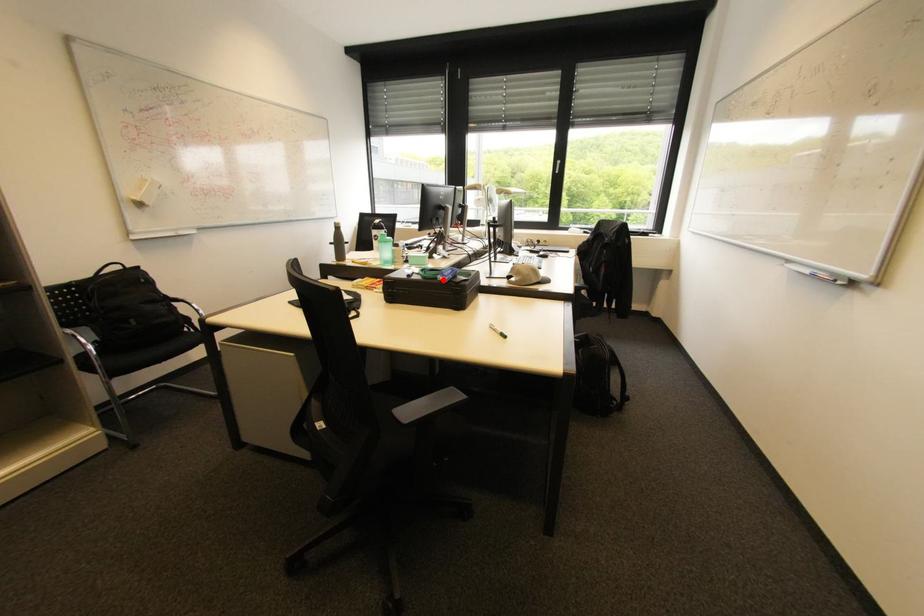
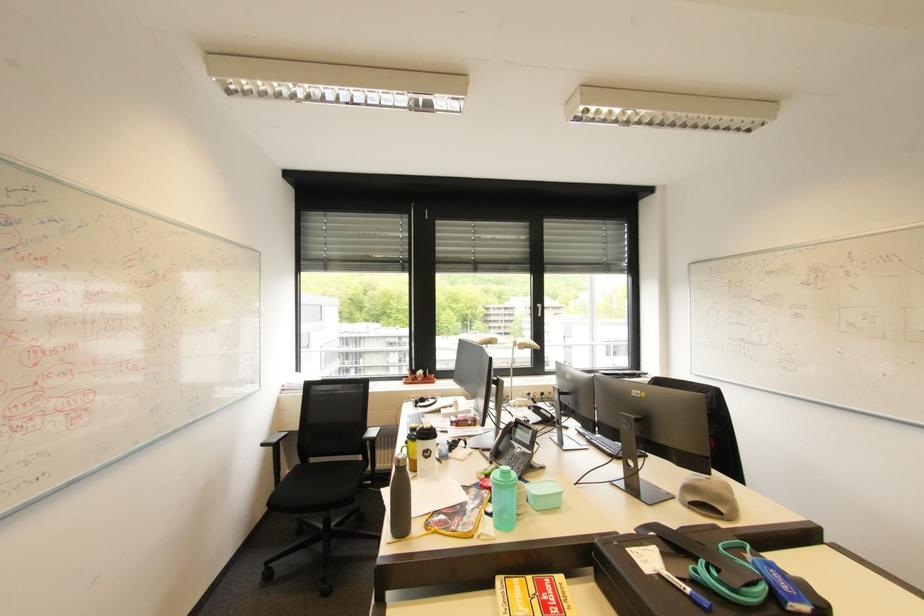
Question: I am providing you with two images of the same scene from different viewpoints. In image1, a red point is highlighted. Considering the same 3D point in image2, which of the following is correct?

Choices:
 (A) It is closer
 (B) It is farther

Answer: (A)